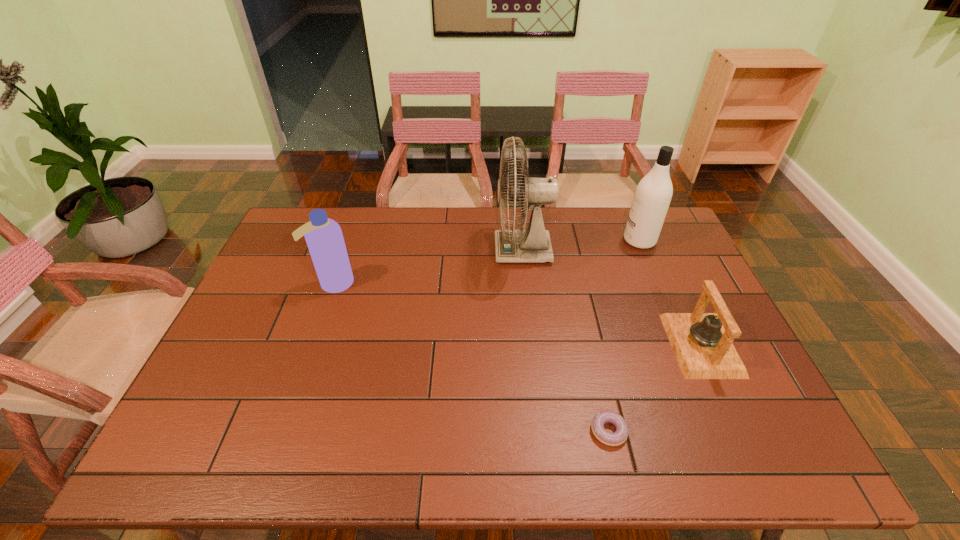
Identify the location of free space located 0.320m on the front-facing side of the fan. Image resolution: width=960 pixels, height=540 pixels. (399, 251).

Where is `free region located 0.370m on the front-facing side of the fan`? The image size is (960, 540). free region located 0.370m on the front-facing side of the fan is located at coordinates tap(384, 251).

You are a GUI agent. You are given a task and a screenshot of the screen. Output one action in this format:
    pyautogui.click(x=<x>, y=<y>)
    Task: Click on the free region located 0.310m on the front-facing side of the taller shampoo
    The width and height of the screenshot is (960, 540).
    Given the screenshot: What is the action you would take?
    pyautogui.click(x=533, y=240)

The image size is (960, 540). I want to click on free space located 0.190m on the front-facing side of the taller shampoo, so click(567, 240).

Find the location of a particular element. This screenshot has height=540, width=960. free point located on the front-facing side of the taller shampoo is located at coordinates (513, 240).

You are a GUI agent. You are given a task and a screenshot of the screen. Output one action in this format:
    pyautogui.click(x=<x>, y=<y>)
    Task: Click on the vacant space located on the back of the leftmost object
    The height and width of the screenshot is (540, 960).
    Given the screenshot: What is the action you would take?
    pyautogui.click(x=359, y=211)

I want to click on free space located on the left of the fourth farthest object, so click(544, 345).

Identify the location of vacant space positioned on the right of the third object from right to left. (741, 431).

Where is `fan that is at the far edge`? This screenshot has height=540, width=960. fan that is at the far edge is located at coordinates (533, 244).

Identify the location of shampoo at the far edge. The height and width of the screenshot is (540, 960). (653, 194).